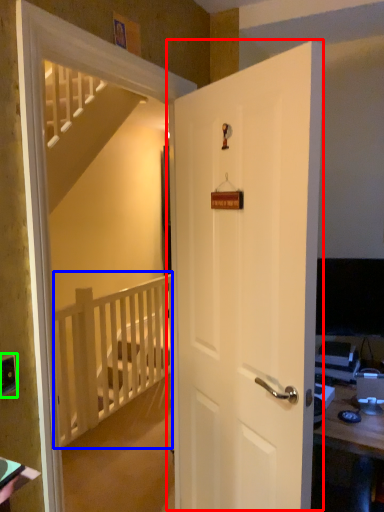
Question: Based on their relative distances, which object is farther from door (highlighted by a red box)? Choose from balustrade (highlighted by a blue box) and electric outlet (highlighted by a green box).

Choices:
 (A) balustrade
 (B) electric outlet

Answer: (A)